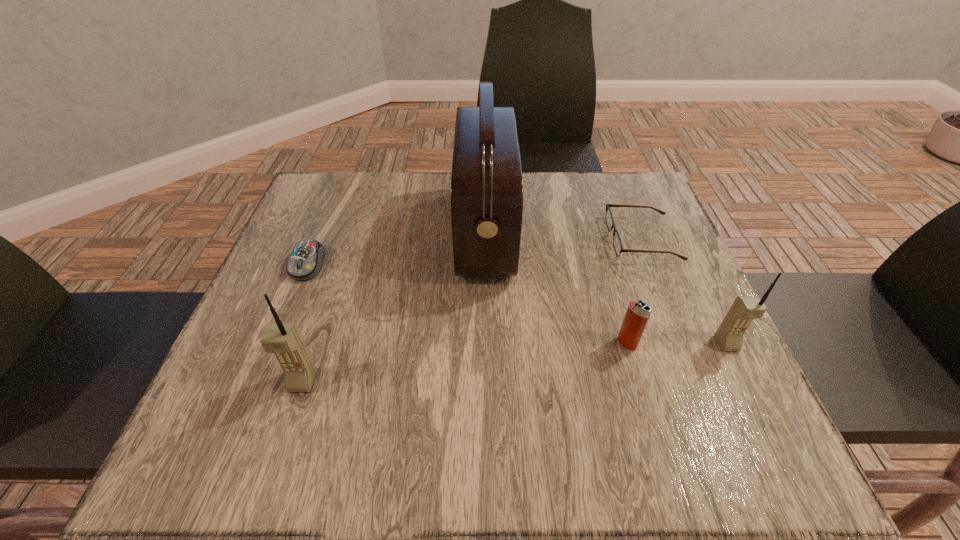
This screenshot has width=960, height=540. What are the coordinates of `spectacles positioned at the far edge` in the screenshot? It's located at (617, 242).

Find the location of a particular element. This screenshot has height=540, width=960. object at the near edge is located at coordinates (284, 340).

Find the location of a particular element. The width and height of the screenshot is (960, 540). cellular telephone present at the left edge is located at coordinates (284, 340).

Identify the location of computer mouse that is at the left edge. (305, 262).

At what (x,y) coordinates should I click in order to perform the action: click on cellular telephone that is positioned at the right edge. Please return your answer as a coordinate pair (x, y). Looking at the image, I should click on (729, 335).

In order to click on spectacles positioned at the right edge in this screenshot , I will do `click(617, 242)`.

Identify the location of igniter located at the right edge. Image resolution: width=960 pixels, height=540 pixels. (637, 314).

Locate an element on the screen. Image resolution: width=960 pixels, height=540 pixels. object at the near left corner is located at coordinates (284, 340).

Locate an element on the screen. This screenshot has width=960, height=540. object that is positioned at the far right corner is located at coordinates (617, 242).

You are a GUI agent. You are given a task and a screenshot of the screen. Output one action in this format:
    pyautogui.click(x=<x>, y=<y>)
    Task: Click on the free region at the far edge
    The image size is (960, 540).
    Given the screenshot: What is the action you would take?
    pyautogui.click(x=433, y=180)